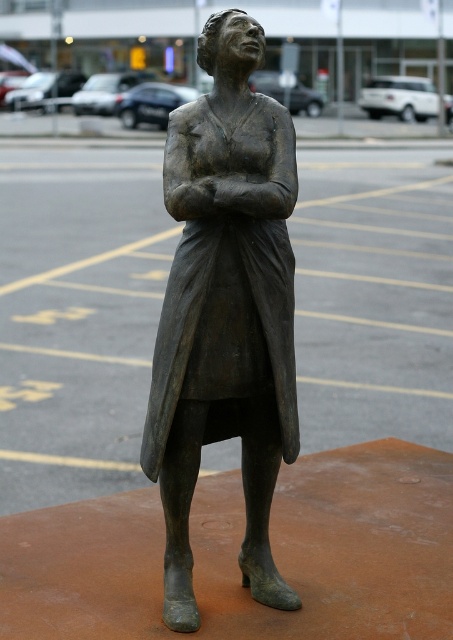
Looking at this image, you are a photographer standing in front of the bronze statue at center. You want to take a photo of the statue without the metallic parking lot at upper center appearing in the background. Is it possible to adjust your position to achieve this?

The bronze statue at center is in front of the metallic parking lot at upper center, so by moving to a position where the statue blocks the view of the parking lot, you can take a photo without the parking lot appearing in the background.

You are a delivery person needing to place a package between the bronze statue at center and the metallic parking lot at upper center. The package requires a minimum of 4 meters of space. Can you fit it there?

The distance between the bronze statue at center and the metallic parking lot at upper center is 5.50 meters, which is more than the required 4 meters. Yes, the package can be placed there.